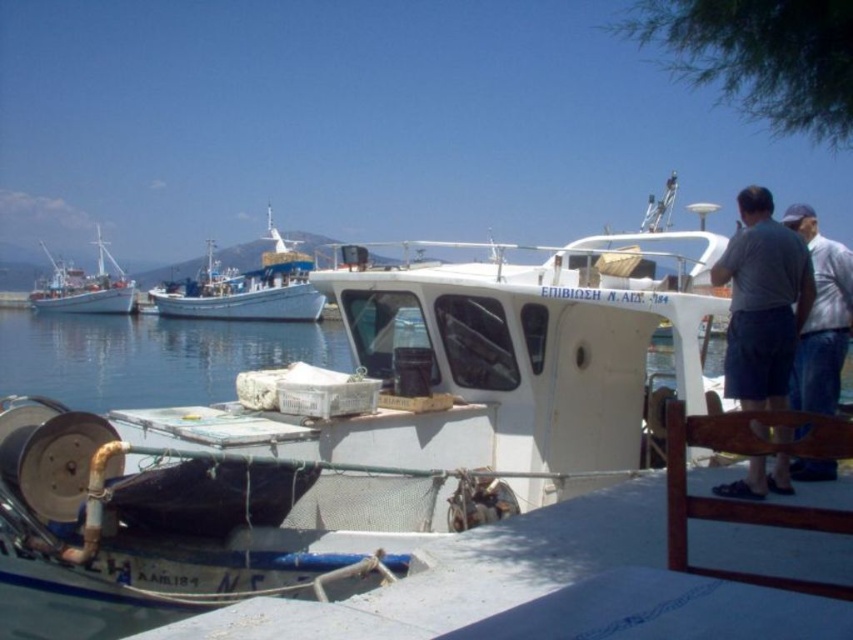
You are standing on the dock and want to place a gray cotton shirt at right on the deck of the white matte fishing boat at left. Given that the shirt is 1.5 feet wide, will it fit on the deck without overlapping the existing items?

The gray cotton shirt at right and white matte fishing boat at left are 155.78 feet apart. Since the shirt is only 1.5 feet wide, it will easily fit on the deck of the white matte fishing boat at left without overlapping existing items.

You are a photographer trying to capture both the gray cotton shirt at right and the white matte fishing boat at left in a single frame. Given their sizes, which object will appear larger in the photo?

The white matte fishing boat at left will appear larger in the photo because it is bigger than the gray cotton shirt at right.

You are a photographer standing at the point marked as point (821, 317). You want to capture a photo of the gray cotton shirt at right. Where should you position yourself relative to the boat to ensure the shirt is visible in your shot?

The gray cotton shirt at right is located at point (821, 317), so you should position yourself at that point to capture the shirt in your photo.